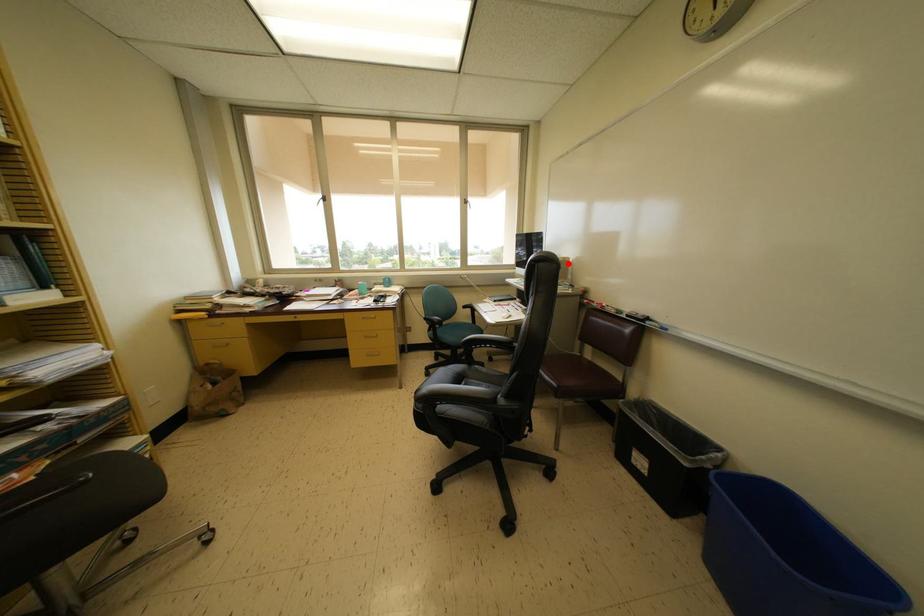
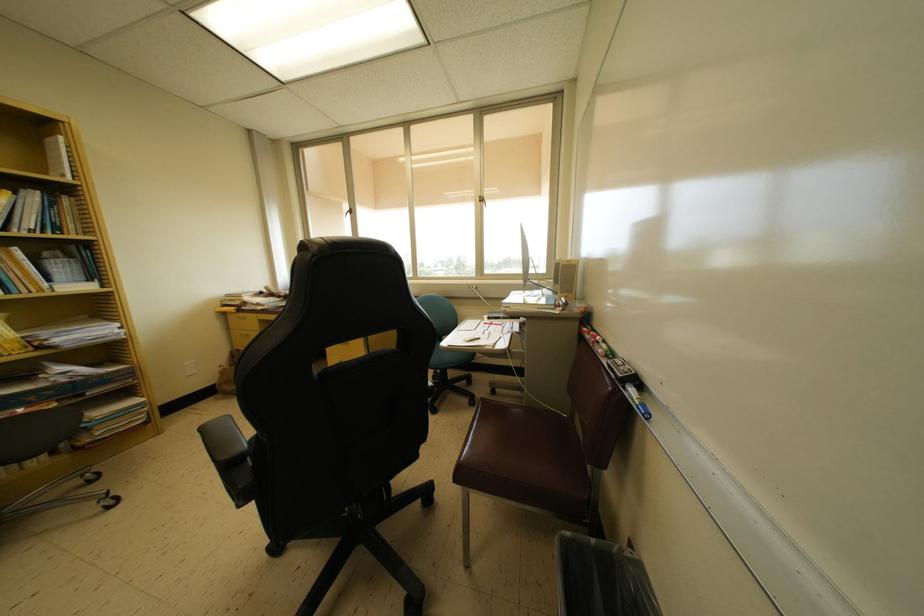
Question: I am providing you with two images of the same scene from different viewpoints. A red point is marked on the first image. Can you still see the location of the red point in image 2?

Choices:
 (A) Yes
 (B) No

Answer: (A)